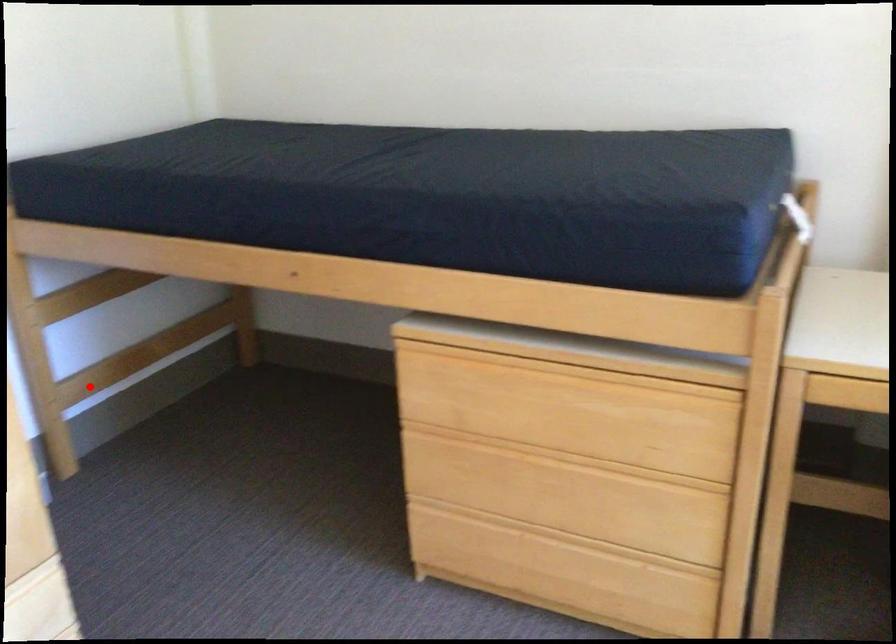
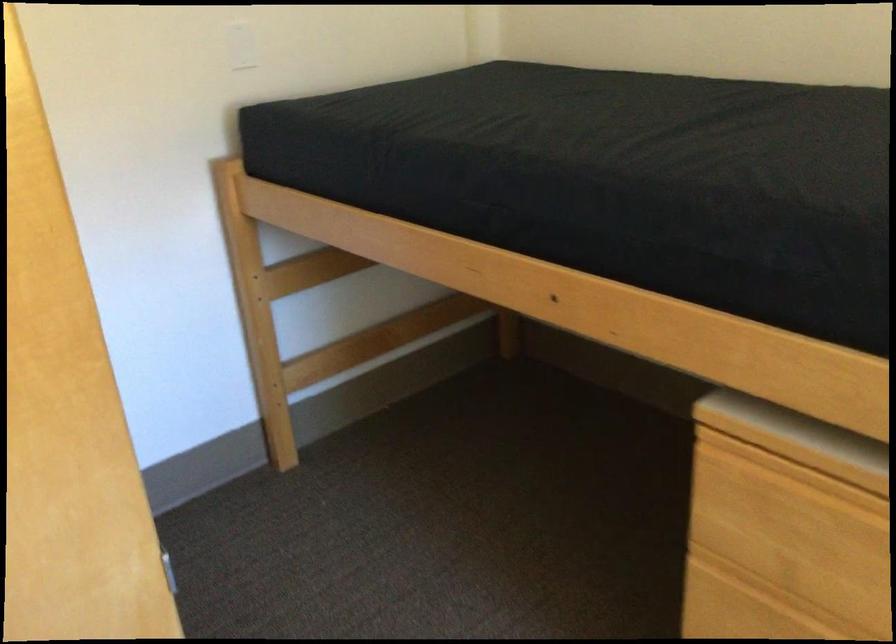
Find the pixel in the second image that matches the highlighted location in the first image.

(319, 368)